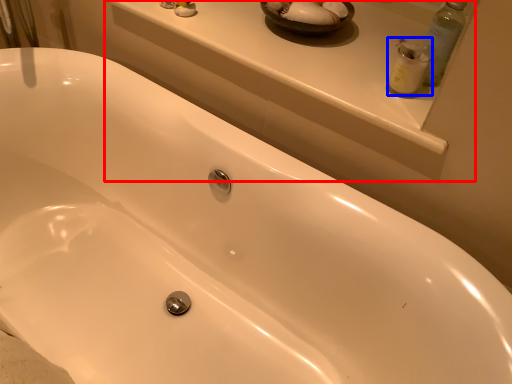
Question: Which of the following is the closest to the observer, window sill (highlighted by a red box) or cleaning product (highlighted by a blue box)?

Choices:
 (A) window sill
 (B) cleaning product

Answer: (A)